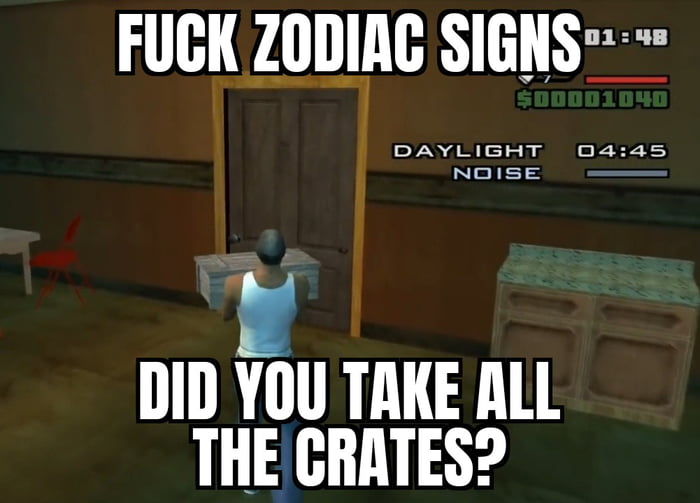
Locate an element on the screen. small crate is located at coordinates (213, 276).